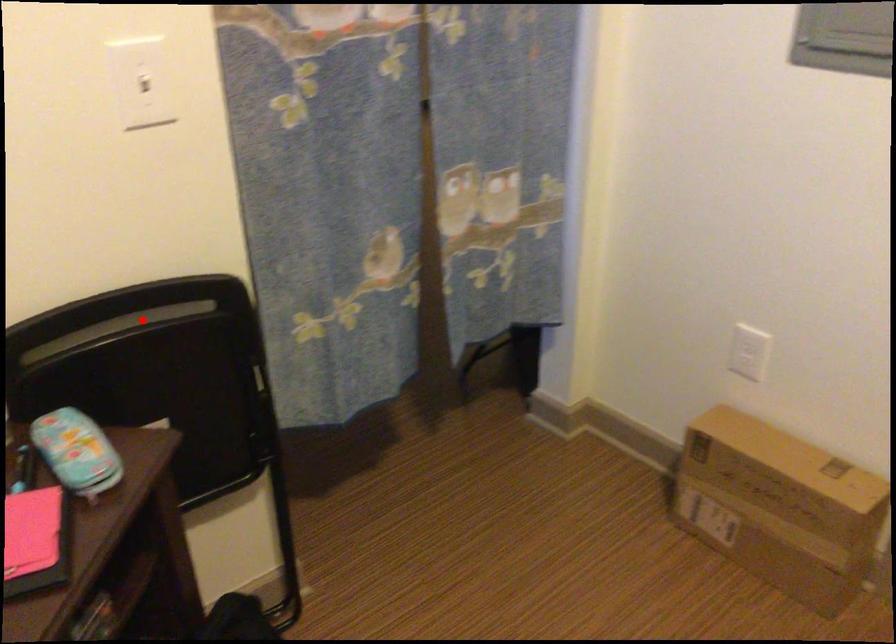
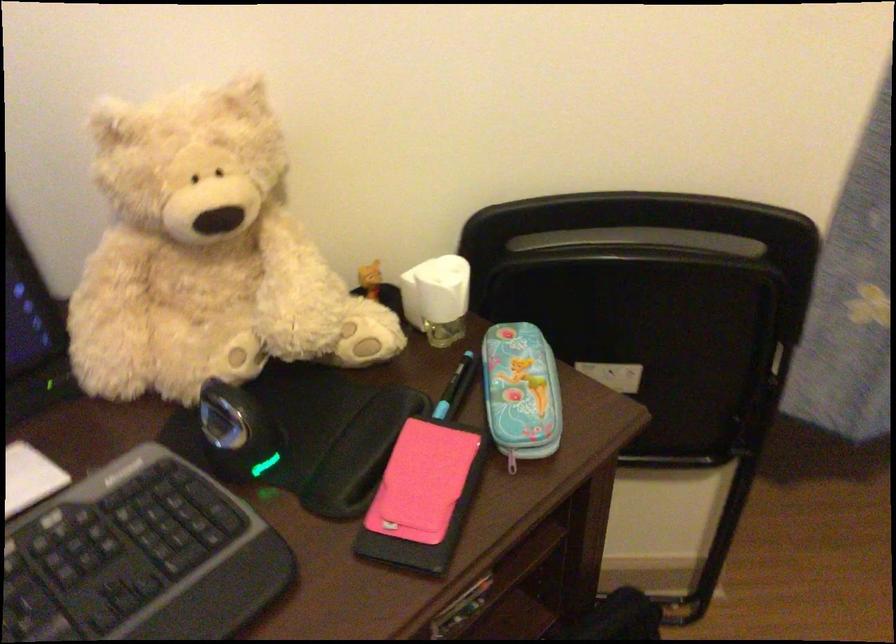
Find the pixel in the second image that matches the highlighted location in the first image.

(642, 240)